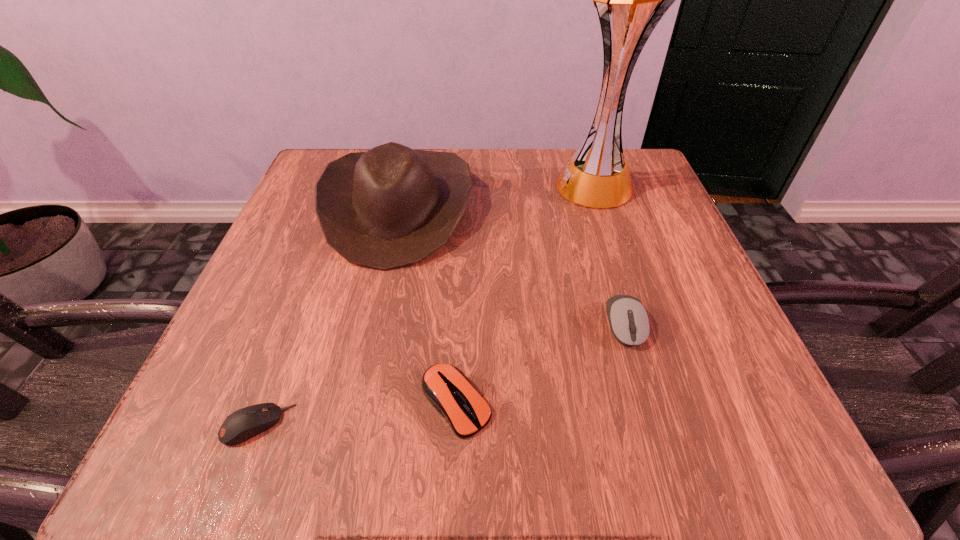
Find the location of `vacant area that lies between the second tallest computer mouse and the second tallest object`. vacant area that lies between the second tallest computer mouse and the second tallest object is located at coordinates (427, 305).

Locate an element on the screen. The image size is (960, 540). object that stands as the third closest to the trophy is located at coordinates (446, 387).

Find the location of a particular element. The height and width of the screenshot is (540, 960). the fourth closest object relative to the trophy is located at coordinates (x=243, y=424).

Identify which computer mouse is located as the nearest to the second computer mouse from right to left. Please provide its 2D coordinates. Your answer should be formatted as a tuple, i.e. [(x, y)], where the tuple contains the x and y coordinates of a point satisfying the conditions above.

[(243, 424)]

This screenshot has width=960, height=540. Identify the location of computer mouse that is the closest one to the shortest computer mouse. coord(446,387).

Where is `vacant space that satisfies the following two spatial constraints: 1. on the front-facing side of the trophy; 2. on the wheel side of the third nearest object`? vacant space that satisfies the following two spatial constraints: 1. on the front-facing side of the trophy; 2. on the wheel side of the third nearest object is located at coordinates (642, 325).